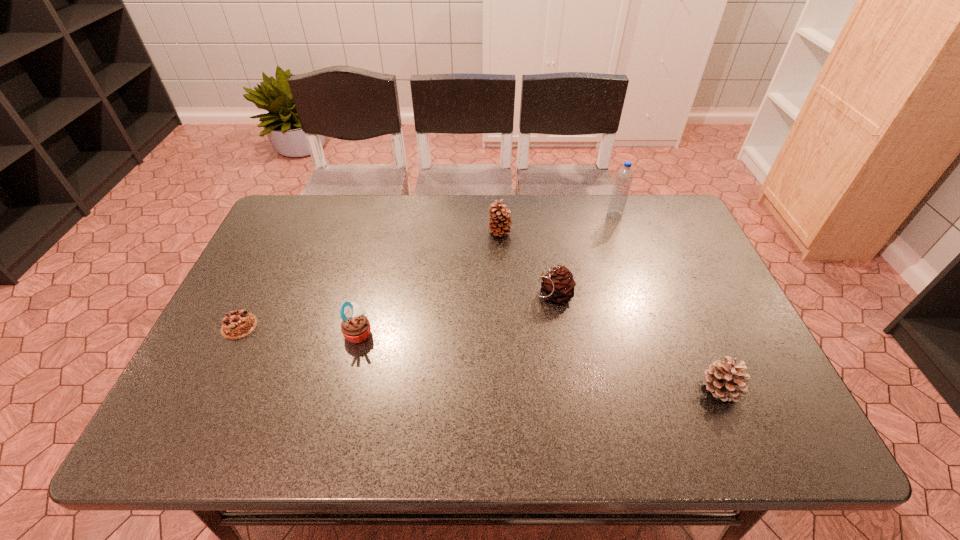
Identify which object is located as the third nearest to the chocolate cake. Please provide its 2D coordinates. Your answer should be formatted as a tuple, i.e. [(x, y)], where the tuple contains the x and y coordinates of a point satisfying the conditions above.

[(557, 285)]

Locate an element on the screen. The image size is (960, 540). object identified as the fourth closest to the chocolate cake is located at coordinates (624, 176).

Identify which pinecone is the second closest to the rightmost pinecone. Please provide its 2D coordinates. Your answer should be formatted as a tuple, i.e. [(x, y)], where the tuple contains the x and y coordinates of a point satisfying the conditions above.

[(500, 221)]

Select which pinecone appears as the second closest to the second pinecone from left to right. Please provide its 2D coordinates. Your answer should be formatted as a tuple, i.e. [(x, y)], where the tuple contains the x and y coordinates of a point satisfying the conditions above.

[(725, 381)]

This screenshot has width=960, height=540. Find the location of `free region that satisfies the following two spatial constraints: 1. on the front-facing side of the nearest object; 2. on the left side of the muffin`. free region that satisfies the following two spatial constraints: 1. on the front-facing side of the nearest object; 2. on the left side of the muffin is located at coordinates (345, 389).

This screenshot has width=960, height=540. Find the location of `free location that satisfies the following two spatial constraints: 1. on the front side of the nearest pinecone; 2. on the right side of the leftmost object`. free location that satisfies the following two spatial constraints: 1. on the front side of the nearest pinecone; 2. on the right side of the leftmost object is located at coordinates (209, 389).

The image size is (960, 540). What are the coordinates of `free region that satisfies the following two spatial constraints: 1. on the front side of the third object from left to right; 2. on the front-facing side of the fifth object from right to left` in the screenshot? It's located at (505, 333).

The height and width of the screenshot is (540, 960). What are the coordinates of `free spot that satisfies the following two spatial constraints: 1. with a leaf charm attached to the nearest object; 2. on the left side of the fourth nearest object` in the screenshot? It's located at (567, 389).

Find the location of `vacant area that satisfies the following two spatial constraints: 1. on the back side of the nearest object; 2. with a leaf charm attached to the second nearest pinecone`. vacant area that satisfies the following two spatial constraints: 1. on the back side of the nearest object; 2. with a leaf charm attached to the second nearest pinecone is located at coordinates (680, 294).

Find the location of `free space that satisfies the following two spatial constraints: 1. with a leaf charm attached to the second pinecone from right to left; 2. on the right side of the rightmost object`. free space that satisfies the following two spatial constraints: 1. with a leaf charm attached to the second pinecone from right to left; 2. on the right side of the rightmost object is located at coordinates (567, 389).